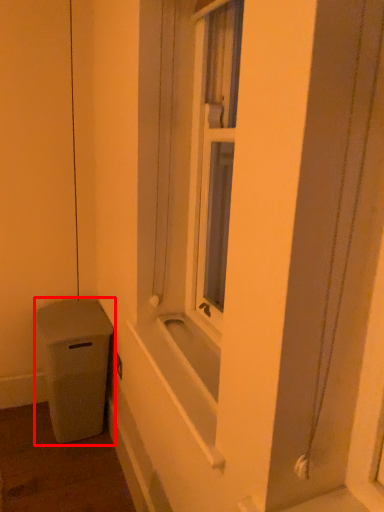
Question: From the image's perspective, what is the correct spatial positioning of waste container (annotated by the red box) in reference to bath?

Choices:
 (A) above
 (B) below

Answer: (B)